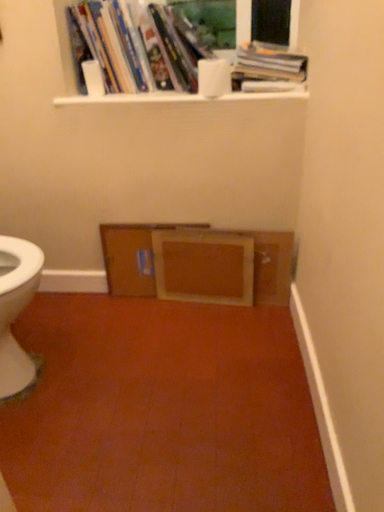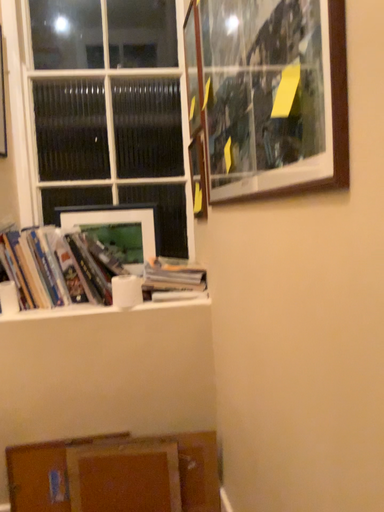
Question: Which way did the camera rotate in the video?

Choices:
 (A) rotated downward
 (B) rotated upward

Answer: (B)